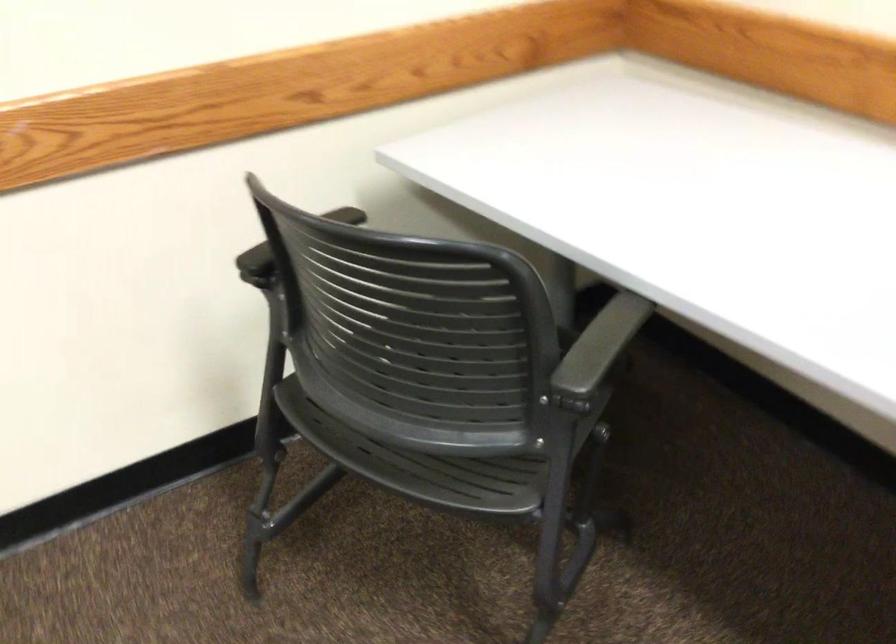
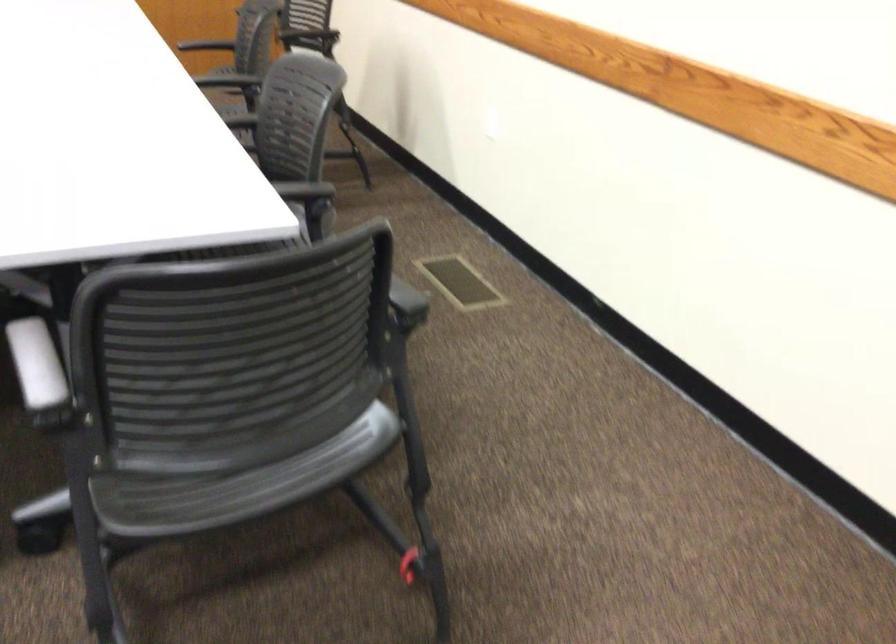
The images are taken continuously from a first-person perspective. In which direction is your viewpoint rotating?

The camera rotated toward left-down.